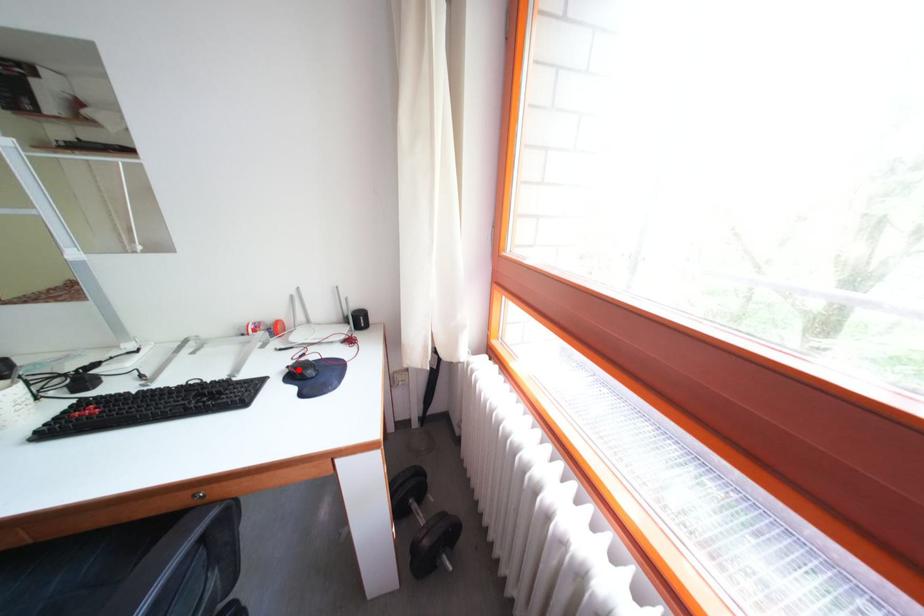
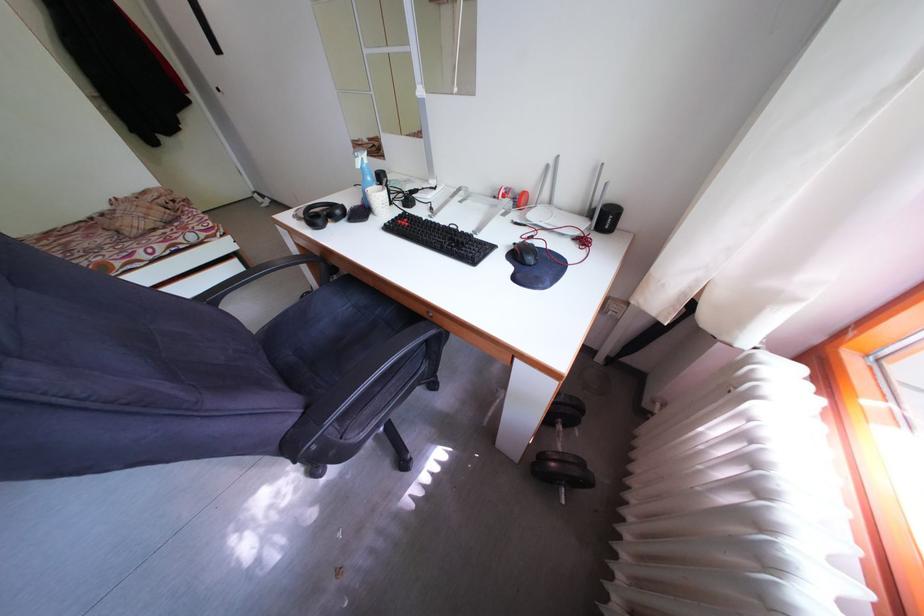
The point at the highlighted location is marked in the first image. Where is the corresponding point in the second image?

(527, 246)